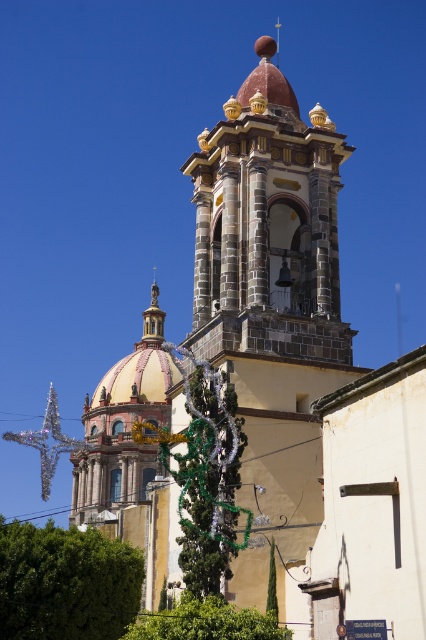
Is green metallic garland at center to the right of green leafy tree at lower center from the viewer's perspective?

No, green metallic garland at center is not to the right of green leafy tree at lower center.

Is green metallic garland at center wider than green leafy tree at lower center?

Correct, the width of green metallic garland at center exceeds that of green leafy tree at lower center.

The height and width of the screenshot is (640, 426). What do you see at coordinates (207, 477) in the screenshot?
I see `green metallic garland at center` at bounding box center [207, 477].

The width and height of the screenshot is (426, 640). I want to click on green metallic garland at center, so click(x=207, y=477).

Measure the distance between green leafy tree at lower center and camera.

106.44 feet

Is green leafy tree at lower center below green leafy tree at center?

Indeed, green leafy tree at lower center is positioned under green leafy tree at center.

What do you see at coordinates (207, 621) in the screenshot? The height and width of the screenshot is (640, 426). I see `green leafy tree at lower center` at bounding box center [207, 621].

Find the location of a particular element. This screenshot has height=640, width=426. green leafy tree at lower center is located at coordinates (207, 621).

Based on the photo, does green metallic garland at center have a greater height compared to green leafy tree at center?

Yes.

Which is in front, point (195, 550) or point (270, 608)?

Point (270, 608)

Identify the location of green metallic garland at center. The width and height of the screenshot is (426, 640). (207, 477).